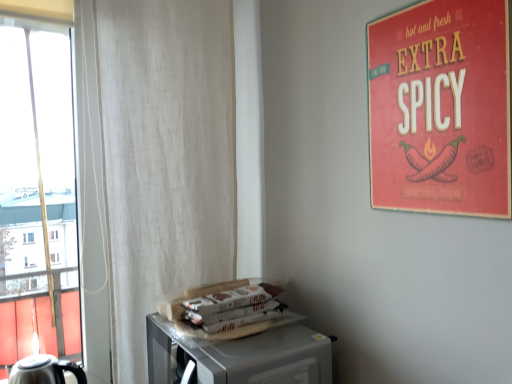
Measure the distance between red matte poster at upper right and camera.

red matte poster at upper right and camera are 25.75 inches apart.

The image size is (512, 384). Describe the element at coordinates (242, 355) in the screenshot. I see `metallic microwave at lower right` at that location.

Measure the distance between point (35,359) and camera.

Point (35,359) and camera are 2.45 meters apart from each other.

This screenshot has width=512, height=384. I want to click on red matte poster at upper right, so click(441, 108).

From a real-world perspective, is red matte poster at upper right above or below stainless steel kettle at lower left?

red matte poster at upper right is situated higher than stainless steel kettle at lower left in the real world.

Is red matte poster at upper right positioned with its back to stainless steel kettle at lower left?

No, red matte poster at upper right is not facing the opposite direction of stainless steel kettle at lower left.

Does point (443, 102) lie in front of point (72, 365)?

Yes, it is.

Is red matte poster at upper right wider or thinner than metallic microwave at lower right?

Considering their sizes, red matte poster at upper right looks slimmer than metallic microwave at lower right.

Between point (475, 134) and point (278, 326), which one is positioned in front?

Positioned in front is point (475, 134).

Relative to metallic microwave at lower right, is red matte poster at upper right in front or behind?

In the image, red matte poster at upper right appears in front of metallic microwave at lower right.

Is stainless steel kettle at lower left turned away from metallic microwave at lower right?

No, stainless steel kettle at lower left's orientation is not away from metallic microwave at lower right.

From the image's perspective, which is below, stainless steel kettle at lower left or metallic microwave at lower right?

stainless steel kettle at lower left is shown below in the image.

Considering the sizes of stainless steel kettle at lower left and metallic microwave at lower right in the image, is stainless steel kettle at lower left taller or shorter than metallic microwave at lower right?

Considering their sizes, stainless steel kettle at lower left has less height than metallic microwave at lower right.

Does white fabric curtain at left have a greater width compared to metallic microwave at lower right?

No.

Looking at this image, from the image's perspective, which is below, white fabric curtain at left or metallic microwave at lower right?

From the image's view, metallic microwave at lower right is below.

Is white fabric curtain at left in front of or behind metallic microwave at lower right in the image?

In the image, white fabric curtain at left appears behind metallic microwave at lower right.

Is white fabric curtain at left facing towards metallic microwave at lower right?

Yes.

Is point (77, 369) closer or farther from the camera than point (114, 313)?

Point (77, 369) appears to be farther away from the viewer than point (114, 313).

Is stainless steel kettle at lower left looking in the opposite direction of white fabric curtain at left?

stainless steel kettle at lower left does not have its back to white fabric curtain at left.

Can white fabric curtain at left be found inside stainless steel kettle at lower left?

No, white fabric curtain at left is located outside of stainless steel kettle at lower left.

Identify the location of kettle behind the white fabric curtain at left. (44, 370).

From a real-world perspective, which object stands above the other?

From a 3D spatial view, red matte poster at upper right is above.

Which is more to the right, metallic microwave at lower right or red matte poster at upper right?

Positioned to the right is red matte poster at upper right.

Is metallic microwave at lower right spatially inside red matte poster at upper right, or outside of it?

metallic microwave at lower right is not inside red matte poster at upper right, it's outside.

Is metallic microwave at lower right turned away from red matte poster at upper right?

No.

Is metallic microwave at lower right at the left side of stainless steel kettle at lower left?

Incorrect, metallic microwave at lower right is not on the left side of stainless steel kettle at lower left.

From a real-world perspective, which object stands above the other?

metallic microwave at lower right, from a real-world perspective.

Is metallic microwave at lower right situated inside stainless steel kettle at lower left or outside?

metallic microwave at lower right is outside stainless steel kettle at lower left.

At what (x,y) coordinates should I click in order to perform the action: click on poster that is above the stainless steel kettle at lower left (from a real-world perspective). Please return your answer as a coordinate pair (x, y). This screenshot has width=512, height=384. Looking at the image, I should click on coord(441,108).

This screenshot has width=512, height=384. I want to click on table that appears behind the red matte poster at upper right, so click(x=242, y=355).

From the image, which object appears to be farther from stainless steel kettle at lower left, red matte poster at upper right or white paper magazine at lower center?

red matte poster at upper right.

Looking at the image, which one is located further to white fabric curtain at left, red matte poster at upper right or metallic microwave at lower right?

red matte poster at upper right is positioned further to the anchor white fabric curtain at left.

Based on their spatial positions, is white fabric curtain at left or stainless steel kettle at lower left closer to metallic microwave at lower right?

Based on the image, white fabric curtain at left appears to be nearer to metallic microwave at lower right.

When comparing their distances from white paper magazine at lower center, does metallic microwave at lower right or stainless steel kettle at lower left seem further?

stainless steel kettle at lower left.

Estimate the real-world distances between objects in this image. Which object is closer to metallic microwave at lower right, white paper magazine at lower center or red matte poster at upper right?

The object closer to metallic microwave at lower right is white paper magazine at lower center.

Looking at the image, which one is located closer to red matte poster at upper right, white paper magazine at lower center or metallic microwave at lower right?

metallic microwave at lower right is closer to red matte poster at upper right.

From the image, which object appears to be nearer to white fabric curtain at left, red matte poster at upper right or white paper magazine at lower center?

Among the two, white paper magazine at lower center is located nearer to white fabric curtain at left.

Based on their spatial positions, is white paper magazine at lower center or metallic microwave at lower right closer to stainless steel kettle at lower left?

metallic microwave at lower right is positioned closer to the anchor stainless steel kettle at lower left.

The width and height of the screenshot is (512, 384). What are the coordinates of `table between white fabric curtain at left and stainless steel kettle at lower left in the up-down direction` in the screenshot? It's located at (242, 355).

What are the coordinates of `curtain situated between stainless steel kettle at lower left and red matte poster at upper right from left to right` in the screenshot? It's located at (151, 166).

You are a GUI agent. You are given a task and a screenshot of the screen. Output one action in this format:
    pyautogui.click(x=<x>, y=<y>)
    Task: Click on the magazine located between white fabric curtain at left and red matte poster at upper right in the left-right direction
    The height and width of the screenshot is (384, 512).
    Given the screenshot: What is the action you would take?
    pyautogui.click(x=234, y=307)

Locate an element on the screen. curtain between red matte poster at upper right and metallic microwave at lower right in the vertical direction is located at coordinates (151, 166).